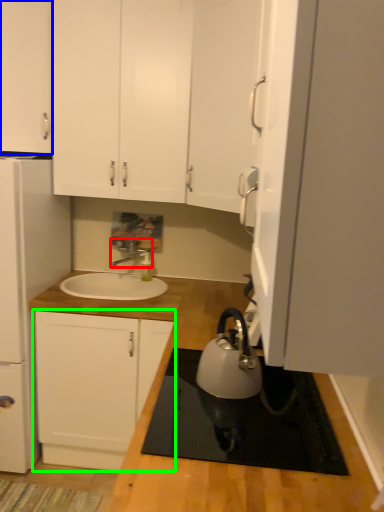
Question: Which is farther away from tap (highlighted by a red box)? cabinetry (highlighted by a blue box) or cabinetry (highlighted by a green box)?

Choices:
 (A) cabinetry
 (B) cabinetry

Answer: (A)